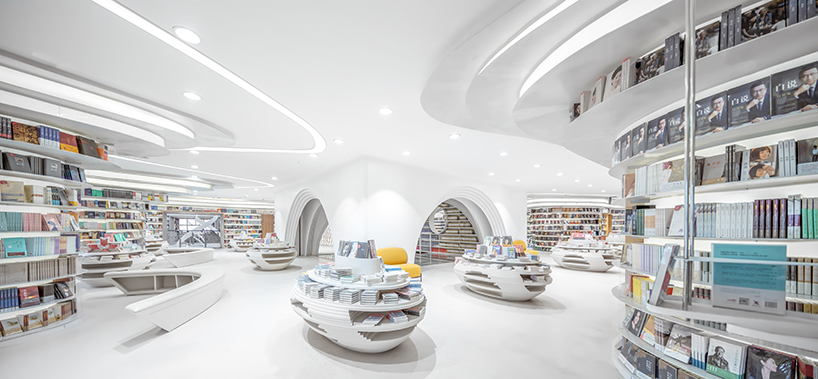
I want to click on archways, so click(308, 195), click(452, 191).